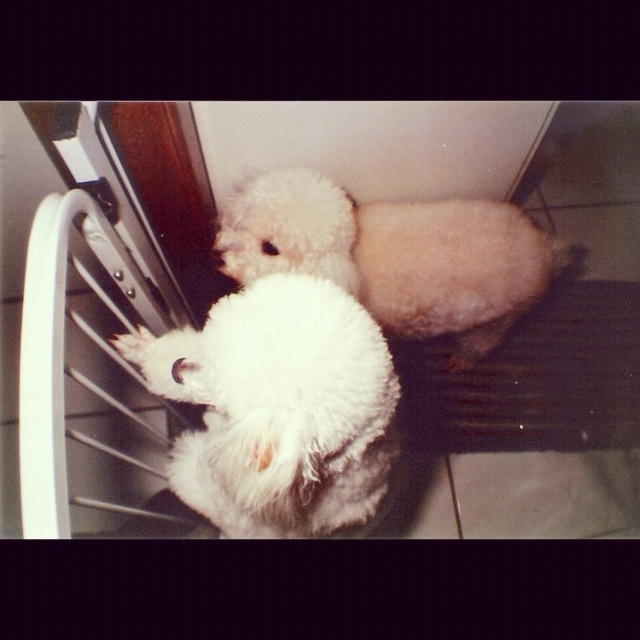
At what (x,y) coordinates should I click in order to perform the action: click on white fluffy dog at left. Please return your answer as a coordinate pair (x, y). The width and height of the screenshot is (640, 640). Looking at the image, I should click on pos(280,410).

Who is positioned more to the right, white fluffy dog at left or white fluffy paw at lower left?

white fluffy dog at left is more to the right.

Is point (340, 497) behind point (134, 349)?

No.

What are the coordinates of `white fluffy dog at left` in the screenshot? It's located at (280, 410).

Is white fluffy dog at center positioned in front of white fluffy paw at lower left?

No, it is behind white fluffy paw at lower left.

What do you see at coordinates (396, 256) in the screenshot?
I see `white fluffy dog at center` at bounding box center [396, 256].

This screenshot has height=640, width=640. I want to click on white fluffy dog at center, so click(x=396, y=256).

Does point (346, 365) come farther from viewer compared to point (432, 205)?

That is False.

From the picture: Is white fluffy dog at left to the right of white fluffy dog at center from the viewer's perspective?

No, white fluffy dog at left is not to the right of white fluffy dog at center.

Does point (248, 419) lie in front of point (428, 296)?

Yes, it is.

I want to click on white fluffy dog at left, so click(x=280, y=410).